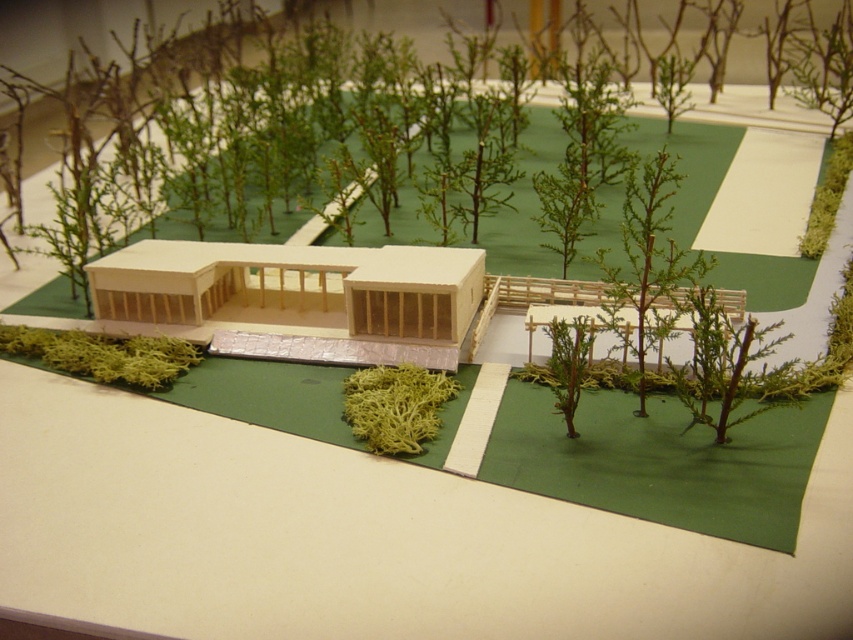
Question: Which is farther from the green matte tree at lower right?

Choices:
 (A) green moss at center
 (B) green matte tree at center-right
 (C) green moss at lower left

Answer: (C)

Question: Is green matte tree at center-right to the right of green moss at lower left from the viewer's perspective?

Choices:
 (A) no
 (B) yes

Answer: (B)

Question: Among these points, which one is nearest to the camera?

Choices:
 (A) (601, 262)
 (B) (80, 353)

Answer: (A)

Question: Does green matte tree at center-right appear on the right side of green moss at center?

Choices:
 (A) no
 (B) yes

Answer: (B)

Question: Considering the relative positions of green matte tree at center-right and green matte tree at lower right in the image provided, where is green matte tree at center-right located with respect to green matte tree at lower right?

Choices:
 (A) left
 (B) right

Answer: (B)

Question: Which point is farther from the camera taking this photo?

Choices:
 (A) (62, 340)
 (B) (393, 387)

Answer: (A)